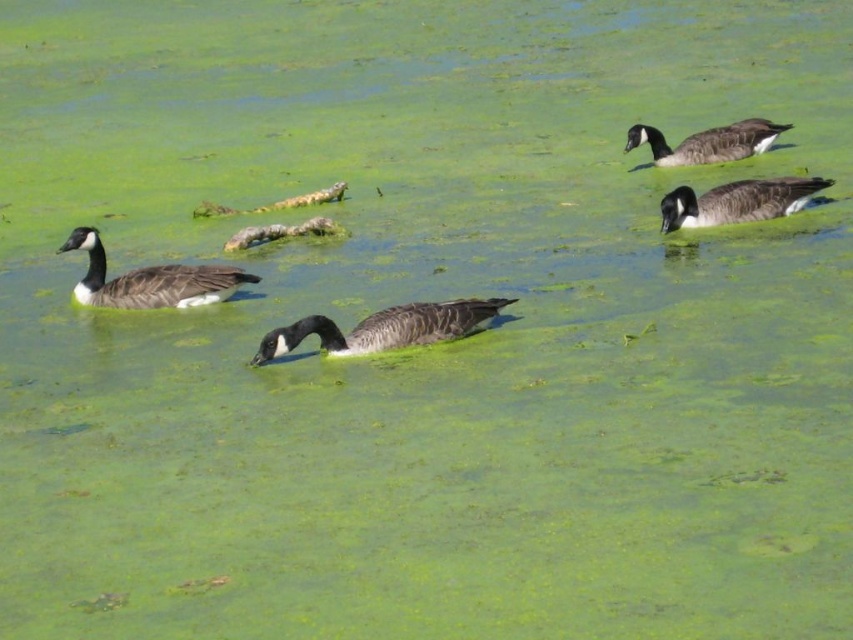
You are standing at the edge of the water and see a point marked at coordinates (384, 328). What object is located at that point?

The point at coordinates (384, 328) corresponds to the black glossy duck at center.

You are a photographer trying to capture a closeup of the black glossy duck at center and the dark gray matte duck at upper right. Since your camera can only focus on one duck at a time, which duck should you choose to ensure the subject is large enough in the frame?

The dark gray matte duck at upper right should be chosen because it occupies more space than the black glossy duck at center, making it larger and easier to focus on for a closeup.

You are standing at the point marked as point (384, 328) in the image. What animal is directly in front of you?

The black glossy duck at center is located at point (384, 328), so the animal directly in front of you is the black glossy duck at center.